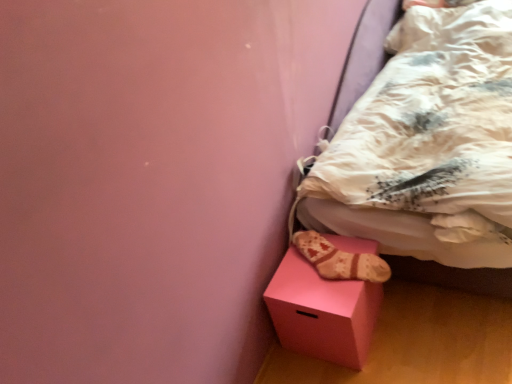
Describe the element at coordinates (340, 260) in the screenshot. I see `beige fabric sock at lower right` at that location.

Where is `pink matte cube at lower right`? The image size is (512, 384). pink matte cube at lower right is located at coordinates tap(322, 311).

How distant is white textured bed at lower right from beige fabric sock at lower right?

They are 22.18 inches apart.

From the image's perspective, which is above, white textured bed at lower right or beige fabric sock at lower right?

white textured bed at lower right is shown above in the image.

Considering the sizes of objects white textured bed at lower right and beige fabric sock at lower right in the image provided, who is smaller, white textured bed at lower right or beige fabric sock at lower right?

Smaller between the two is beige fabric sock at lower right.

Is beige fabric sock at lower right inside white textured bed at lower right?

That's incorrect, beige fabric sock at lower right is not inside white textured bed at lower right.

Where is `footwear above the pink matte cube at lower right (from the image's perspective)`? footwear above the pink matte cube at lower right (from the image's perspective) is located at coordinates (340, 260).

Who is taller, beige fabric sock at lower right or pink matte cube at lower right?

pink matte cube at lower right.

Could you tell me if beige fabric sock at lower right is facing pink matte cube at lower right?

Yes.

Looking at this image, considering the positions of objects beige fabric sock at lower right and pink matte cube at lower right in the image provided, who is in front, beige fabric sock at lower right or pink matte cube at lower right?

pink matte cube at lower right is in front.

Is beige fabric sock at lower right oriented towards white textured bed at lower right?

No.

Where is `footwear below the white textured bed at lower right (from a real-world perspective)`? footwear below the white textured bed at lower right (from a real-world perspective) is located at coordinates coord(340,260).

Are beige fabric sock at lower right and white textured bed at lower right far apart?

No, there isn't a large distance between beige fabric sock at lower right and white textured bed at lower right.

Where is `bed lying above the pink matte cube at lower right (from the image's perspective)`? The image size is (512, 384). bed lying above the pink matte cube at lower right (from the image's perspective) is located at coordinates click(429, 154).

Who is smaller, white textured bed at lower right or pink matte cube at lower right?

Smaller between the two is pink matte cube at lower right.

Considering the positions of objects white textured bed at lower right and pink matte cube at lower right in the image provided, who is more to the right, white textured bed at lower right or pink matte cube at lower right?

From the viewer's perspective, white textured bed at lower right appears more on the right side.

Can you confirm if white textured bed at lower right is wider than pink matte cube at lower right?

Yes.

In the image, is pink matte cube at lower right on the left side or the right side of beige fabric sock at lower right?

From the image, it's evident that pink matte cube at lower right is to the left of beige fabric sock at lower right.

Could you tell me if pink matte cube at lower right is facing beige fabric sock at lower right?

No, pink matte cube at lower right is not aimed at beige fabric sock at lower right.

Does point (371, 304) appear closer or farther from the camera than point (328, 241)?

Point (371, 304).

Based on the photo, from a real-world perspective, is pink matte cube at lower right positioned above or below beige fabric sock at lower right?

pink matte cube at lower right is below beige fabric sock at lower right.

Between pink matte cube at lower right and white textured bed at lower right, which one appears on the right side from the viewer's perspective?

white textured bed at lower right is more to the right.

Is pink matte cube at lower right touching white textured bed at lower right?

pink matte cube at lower right is not next to white textured bed at lower right, and they're not touching.

Which object is further away from the camera taking this photo, pink matte cube at lower right or white textured bed at lower right?

pink matte cube at lower right is more distant.

Which object is thinner, pink matte cube at lower right or white textured bed at lower right?

pink matte cube at lower right.

Locate an element on the screen. This screenshot has height=384, width=512. footwear behind the white textured bed at lower right is located at coordinates (340, 260).

At what (x,y) coordinates should I click in order to perform the action: click on box directly beneath the beige fabric sock at lower right (from a real-world perspective). Please return your answer as a coordinate pair (x, y). Looking at the image, I should click on (322, 311).

Based on their spatial positions, is beige fabric sock at lower right or pink matte cube at lower right further from white textured bed at lower right?

beige fabric sock at lower right.

Looking at this image, based on their spatial positions, is beige fabric sock at lower right or white textured bed at lower right closer to pink matte cube at lower right?

The object closer to pink matte cube at lower right is beige fabric sock at lower right.

When comparing their distances from white textured bed at lower right, does pink matte cube at lower right or beige fabric sock at lower right seem further?

Among the two, beige fabric sock at lower right is located further to white textured bed at lower right.

Looking at the image, which one is located further to beige fabric sock at lower right, white textured bed at lower right or pink matte cube at lower right?

white textured bed at lower right.

Looking at the image, which one is located closer to beige fabric sock at lower right, pink matte cube at lower right or white textured bed at lower right?

pink matte cube at lower right is positioned closer to the anchor beige fabric sock at lower right.

From the picture: Based on their spatial positions, is white textured bed at lower right or beige fabric sock at lower right further from pink matte cube at lower right?

white textured bed at lower right is further to pink matte cube at lower right.

Locate an element on the screen. This screenshot has height=384, width=512. footwear between white textured bed at lower right and pink matte cube at lower right from top to bottom is located at coordinates (340, 260).